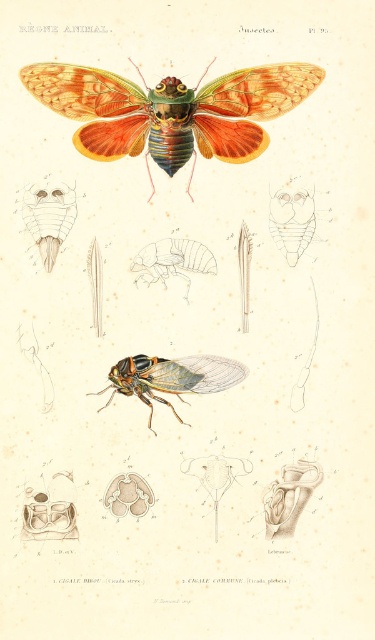
Does shiny metallic cicada at upper center have a larger size compared to translucent orange winged insect at center?

Yes.

Between shiny metallic cicada at upper center and translucent orange winged insect at center, which one is positioned lower?

translucent orange winged insect at center is below.

This screenshot has height=640, width=375. What do you see at coordinates (172, 109) in the screenshot?
I see `shiny metallic cicada at upper center` at bounding box center [172, 109].

I want to click on shiny metallic cicada at upper center, so click(x=172, y=109).